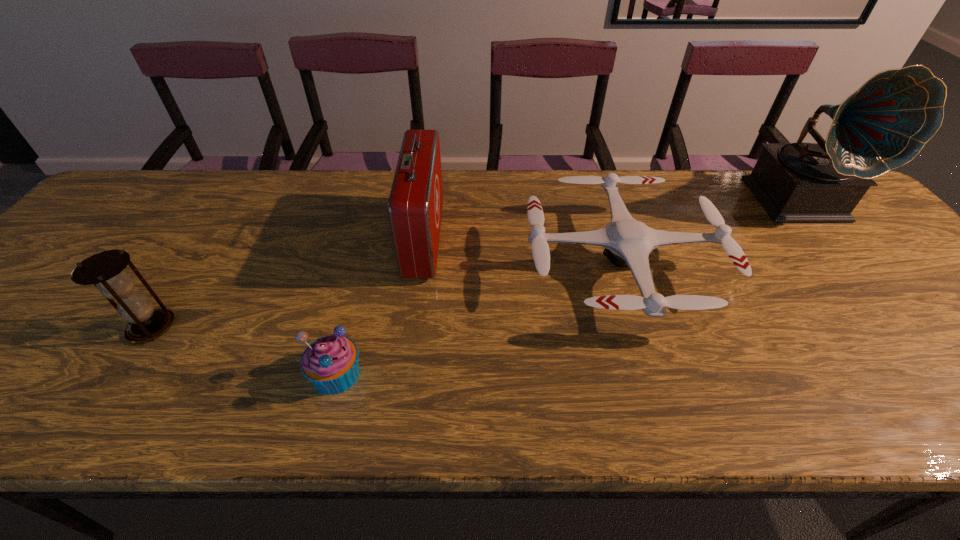
Where is `the tallest object`? the tallest object is located at coordinates (883, 125).

At what (x,y) coordinates should I click in order to perform the action: click on record player. Please return your answer as a coordinate pair (x, y). The height and width of the screenshot is (540, 960). Looking at the image, I should click on (883, 125).

Find the location of a particular element. This screenshot has height=540, width=960. the fourth shortest object is located at coordinates (415, 204).

Where is `the first-aid kit`? Image resolution: width=960 pixels, height=540 pixels. the first-aid kit is located at coordinates (415, 204).

Locate an element on the screen. The image size is (960, 540). the leftmost object is located at coordinates (104, 269).

Where is `hourglass`? hourglass is located at coordinates click(x=104, y=269).

The width and height of the screenshot is (960, 540). I want to click on the fourth object from left to right, so click(627, 242).

This screenshot has width=960, height=540. In order to click on muffin in this screenshot , I will do `click(331, 363)`.

Locate an element on the screen. The width and height of the screenshot is (960, 540). the nearest object is located at coordinates (331, 363).

I want to click on vacant region located 0.130m on the horn of the rightmost object, so click(855, 265).